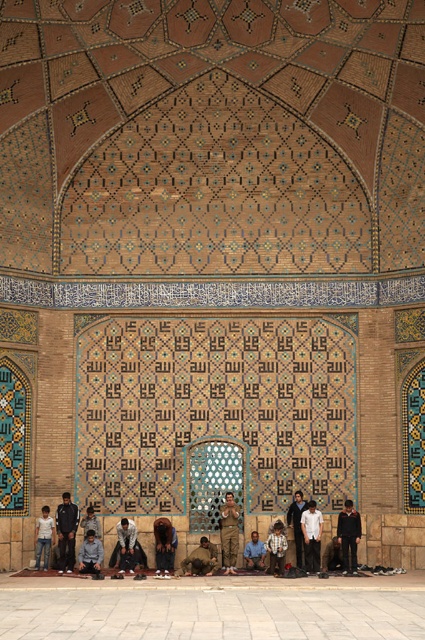
You are standing in the mosque and notice two fabrics. One is the dark blue fabric at lower left and the other is the dark gray fabric at lower center. Which fabric is positioned more to the left side?

The dark blue fabric at lower left is positioned more to the left side than the dark gray fabric at lower center.

You are standing in the mosque and see the dark blue fabric at lower left and the dark gray fabric at lower center. Which fabric is shorter in height?

The dark blue fabric at lower left is not as tall as the dark gray fabric at lower center, so the dark blue fabric at lower left is shorter in height.

You are standing inside the mosque and want to know how far the point at coordinates (353,547) is from where you are standing. Can you determine the distance?

The point at coordinates (353,547) is 238.02 feet away from the camera, so the distance from where you are standing is approximately 238.02 feet.